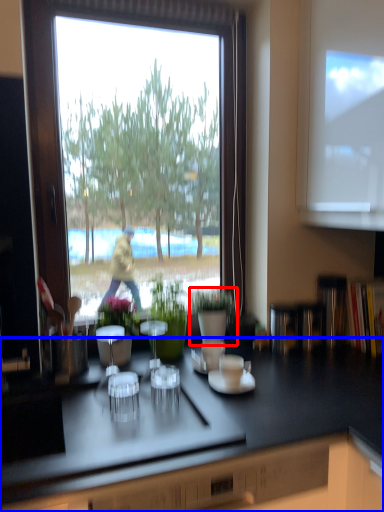
Question: Which point is closer to the camera, houseplant (highlighted by a red box) or countertop (highlighted by a blue box)?

Choices:
 (A) houseplant
 (B) countertop

Answer: (B)